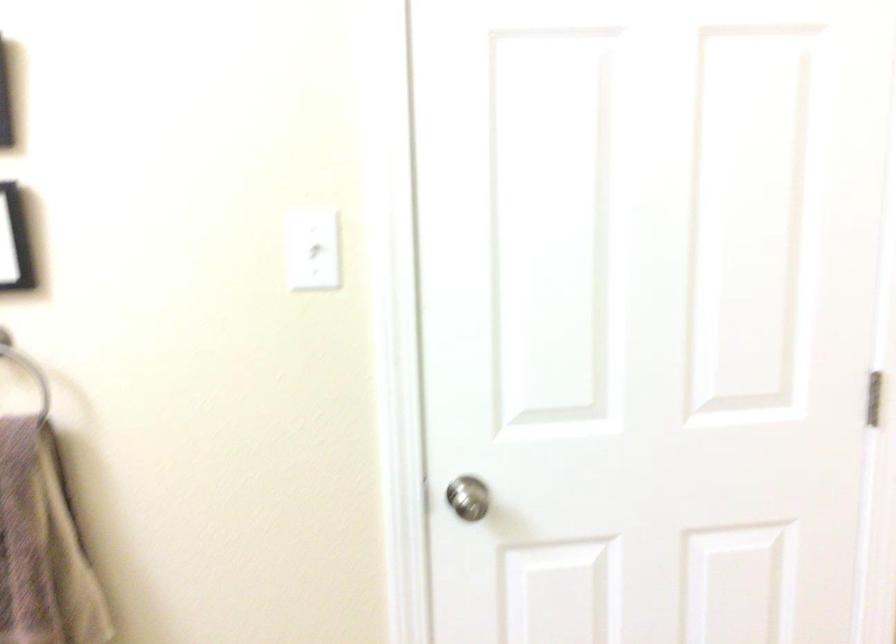
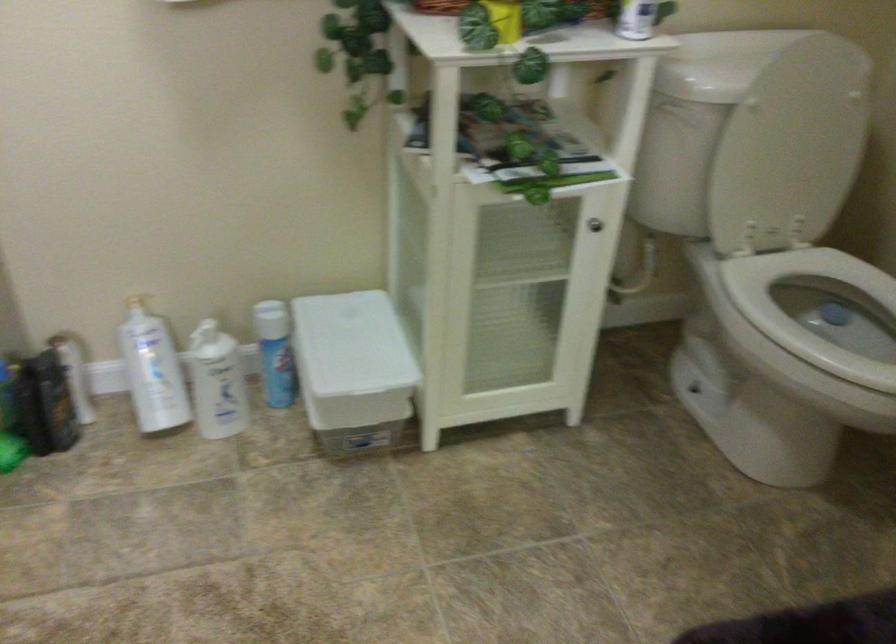
First-person continuous shooting, in which direction is the camera rotating?

The rotation direction of the camera is right-down.